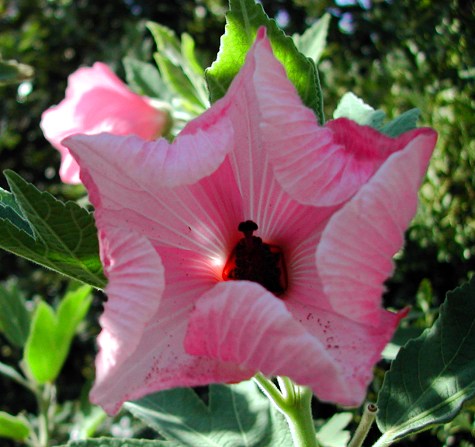
Locate an element on the screen. 2nd flower is located at coordinates (98, 100).